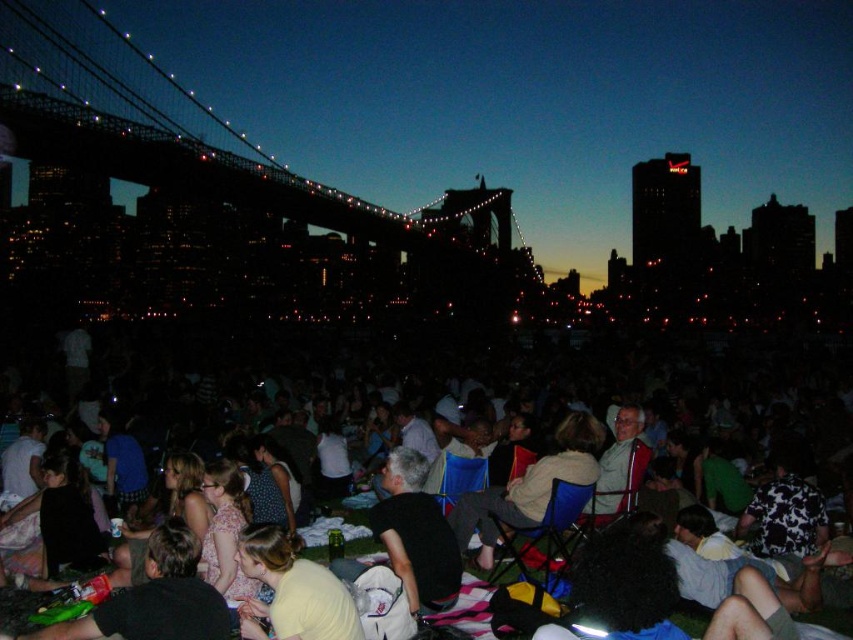
You are a photographer standing at the event location. You want to take a photo of the matte black chairs at center from a distance where they appear as small as possible while still being recognizable. Given that the chairs are 263.95 meters away from your current position, what is the farthest distance you can move away from them to achieve this?

The farthest distance you can move away from the matte black chairs at center is 263.95 meters, as that is their current distance from the camera. Moving further away would make them too small to recognize.

Consider the image. You are part of the crowd at this evening event and want to see the stage better. You notice a yellow cotton shirt at center and matte black chairs at center. Which object is closer to the front of the crowd?

The matte black chairs at center are closer to the front of the crowd because the yellow cotton shirt at center is behind them.

You are a photographer at the event and want to capture both the yellow cotton shirt at center and the light brown fabric jacket at center in your shot. Which clothing item appears shorter in the photo?

The yellow cotton shirt at center appears shorter than the light brown fabric jacket at center in the photo.